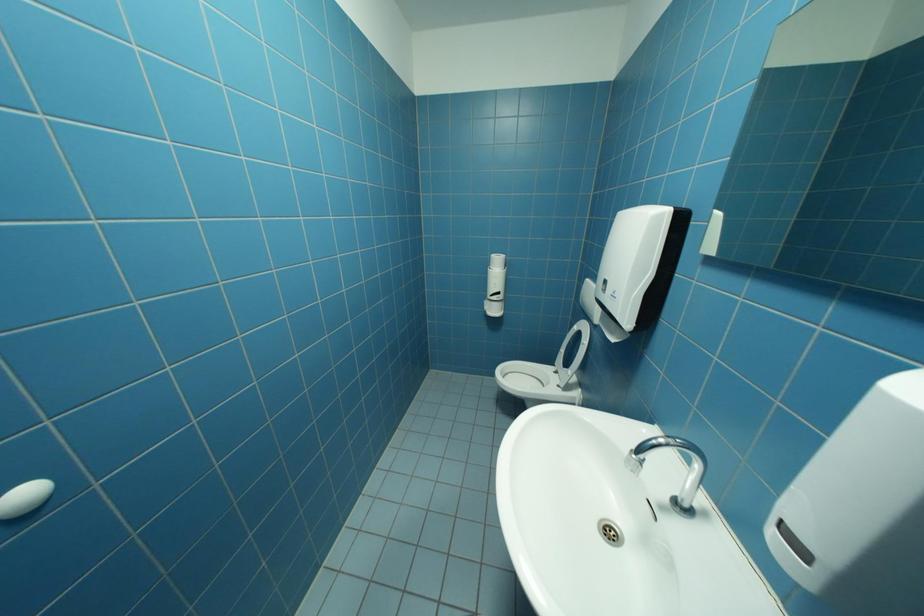
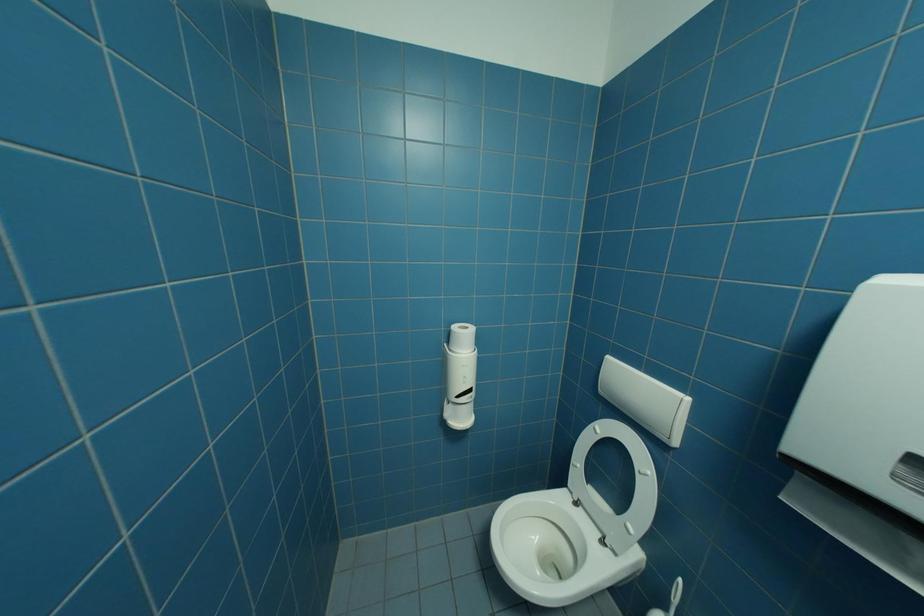
Question: The images are taken continuously from a first-person perspective. In which direction are you moving?

Choices:
 (A) Left
 (B) Right
 (C) Forward
 (D) Backward

Answer: (C)